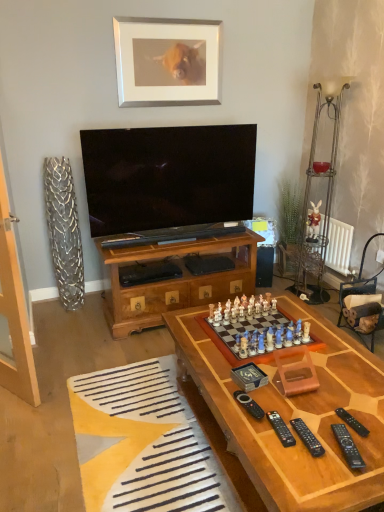
I want to click on vacant area that lies to the right of wooden chess set at center, so click(331, 344).